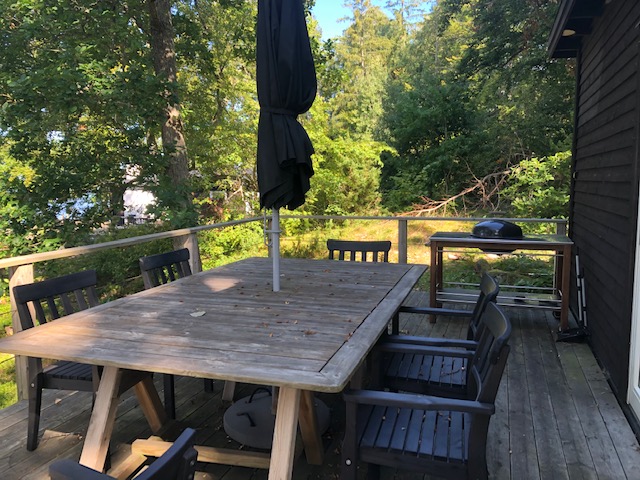
At what (x,y) coordinates should I click in order to perform the action: click on wooden flooring. Please return your answer as a coordinate pair (x, y). This screenshot has height=480, width=640. Looking at the image, I should click on (553, 411), (19, 438).